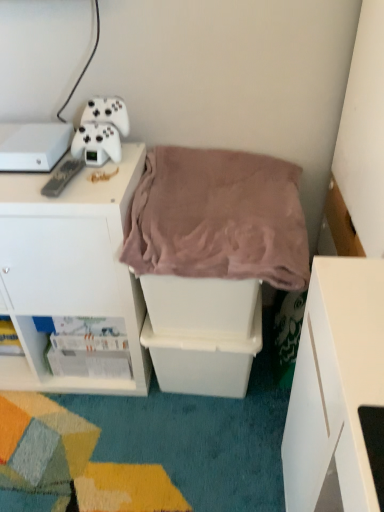
The image size is (384, 512). In order to click on vacant area located to the right-hand side of black plastic remote at upper left in this screenshot , I will do `click(103, 182)`.